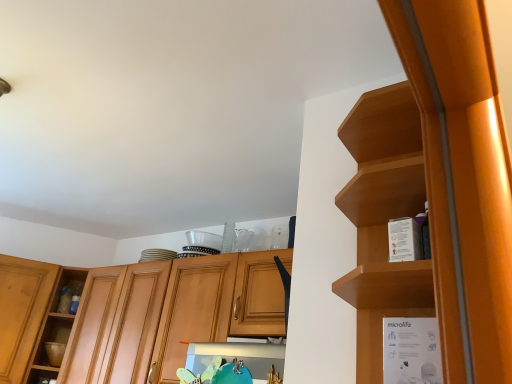
What do you see at coordinates (139, 312) in the screenshot? This screenshot has height=384, width=512. I see `wooden cabinet at center, acting as the 2th cabinetry starting from the right` at bounding box center [139, 312].

In order to face white cardboard box at right, should I rotate leftwards or rightwards?

Rotate your view right by about 22.180°.

How much space does wooden shelf at upper right, marked as the first cabinetry in a front-to-back arrangement, occupy vertically?

The height of wooden shelf at upper right, marked as the first cabinetry in a front-to-back arrangement, is 27.11 inches.

I want to click on wooden cabinet at center, which is the second cabinetry in front-to-back order, so [139, 312].

Considering the sizes of objects wooden shelf at upper right, which appears as the second cabinetry when viewed from the back, and white cardboard box at right in the image provided, who is taller, wooden shelf at upper right, which appears as the second cabinetry when viewed from the back, or white cardboard box at right?

wooden shelf at upper right, which appears as the second cabinetry when viewed from the back, is taller.

From a real-world perspective, is wooden shelf at upper right, which is the first cabinetry in right-to-left order, positioned under white cardboard box at right based on gravity?

Incorrect, from a real-world perspective, wooden shelf at upper right, which is the first cabinetry in right-to-left order, is higher than white cardboard box at right.

Can you confirm if wooden shelf at upper right, marked as the first cabinetry in a front-to-back arrangement, is smaller than white cardboard box at right?

No.

Is wooden shelf at upper right, which is the 2th cabinetry from left to right, at the right side of white cardboard box at right?

Incorrect, wooden shelf at upper right, which is the 2th cabinetry from left to right, is not on the right side of white cardboard box at right.

From the image's perspective, is wooden shelf at upper right, which is the first cabinetry in right-to-left order, located beneath wooden cabinet at center, which is the second cabinetry in front-to-back order?

No.

Is wooden shelf at upper right, which appears as the second cabinetry when viewed from the back, aimed at wooden cabinet at center, arranged as the first cabinetry when viewed from the left?

No, wooden shelf at upper right, which appears as the second cabinetry when viewed from the back, is not aimed at wooden cabinet at center, arranged as the first cabinetry when viewed from the left.

In the image, is wooden shelf at upper right, which is the 2th cabinetry from left to right, positioned in front of or behind wooden cabinet at center, which is the second cabinetry in front-to-back order?

Clearly, wooden shelf at upper right, which is the 2th cabinetry from left to right, is in front of wooden cabinet at center, which is the second cabinetry in front-to-back order.

Who is taller, white cardboard box at right or wooden cabinet at center, arranged as the first cabinetry when viewed from the left?

With more height is wooden cabinet at center, arranged as the first cabinetry when viewed from the left.

Is white cardboard box at right located outside wooden cabinet at center, arranged as the first cabinetry when viewed from the left?

Yes.

Is there a large distance between white cardboard box at right and wooden cabinet at center, arranged as the first cabinetry when viewed from the left?

Yes, white cardboard box at right is far from wooden cabinet at center, arranged as the first cabinetry when viewed from the left.

Could you tell me if white cardboard box at right is facing wooden cabinet at center, which is the second cabinetry in front-to-back order?

No.

Between point (362, 368) and point (453, 350), which one is positioned in front?

The point (453, 350) is in front.

Can you confirm if white cardboard box at right is bigger than wooden shelf at upper right, which appears as the second cabinetry when viewed from the back?

No.

From the image's perspective, between white cardboard box at right and wooden shelf at upper right, marked as the first cabinetry in a front-to-back arrangement, which one is located above?

wooden shelf at upper right, marked as the first cabinetry in a front-to-back arrangement, appears higher in the image.

Are white cardboard box at right and wooden shelf at upper right, which is the first cabinetry in right-to-left order, far apart?

They are positioned close to each other.

Is wooden cabinet at center, which is the first cabinetry from back to front, in front of white cardboard box at right?

No, it is behind white cardboard box at right.

Is wooden cabinet at center, arranged as the first cabinetry when viewed from the left, taller or shorter than white cardboard box at right?

wooden cabinet at center, arranged as the first cabinetry when viewed from the left, is taller than white cardboard box at right.

Is wooden cabinet at center, which is the first cabinetry from back to front, to the right of white cardboard box at right from the viewer's perspective?

In fact, wooden cabinet at center, which is the first cabinetry from back to front, is to the left of white cardboard box at right.

Is point (16, 338) positioned before point (413, 167)?

No, it is behind (413, 167).

From a real-world perspective, is wooden cabinet at center, which is the second cabinetry in front-to-back order, on wooden shelf at upper right, which is the first cabinetry in right-to-left order?

Incorrect, from a real-world perspective, wooden cabinet at center, which is the second cabinetry in front-to-back order, is lower than wooden shelf at upper right, which is the first cabinetry in right-to-left order.

Who is taller, wooden cabinet at center, which is the second cabinetry in front-to-back order, or wooden shelf at upper right, which is the 2th cabinetry from left to right?

wooden cabinet at center, which is the second cabinetry in front-to-back order, is taller.

I want to click on cabinet lying below the wooden shelf at upper right, which is the 2th cabinetry from left to right (from the image's perspective), so click(x=376, y=340).

Where is `cabinetry that is under the wooden shelf at upper right, marked as the first cabinetry in a front-to-back arrangement (from a real-world perspective)`? cabinetry that is under the wooden shelf at upper right, marked as the first cabinetry in a front-to-back arrangement (from a real-world perspective) is located at coordinates (139, 312).

Estimate the real-world distances between objects in this image. Which object is further from wooden shelf at upper right, which appears as the second cabinetry when viewed from the back, white cardboard box at right or wooden cabinet at center, which is the first cabinetry from back to front?

wooden cabinet at center, which is the first cabinetry from back to front, is further to wooden shelf at upper right, which appears as the second cabinetry when viewed from the back.

When comparing their distances from wooden cabinet at center, acting as the 2th cabinetry starting from the right, does wooden shelf at upper right, marked as the first cabinetry in a front-to-back arrangement, or white cardboard box at right seem closer?

Among the two, wooden shelf at upper right, marked as the first cabinetry in a front-to-back arrangement, is located nearer to wooden cabinet at center, acting as the 2th cabinetry starting from the right.

Considering their positions, is wooden cabinet at center, acting as the 2th cabinetry starting from the right, positioned closer to white cardboard box at right than wooden shelf at upper right, which is the 2th cabinetry from left to right?

wooden shelf at upper right, which is the 2th cabinetry from left to right, is positioned closer to the anchor white cardboard box at right.

When comparing their distances from white cardboard box at right, does wooden shelf at upper right, which appears as the second cabinetry when viewed from the back, or wooden cabinet at center, which is the first cabinetry from back to front, seem further?

Among the two, wooden cabinet at center, which is the first cabinetry from back to front, is located further to white cardboard box at right.

Estimate the real-world distances between objects in this image. Which object is further from wooden shelf at upper right, which appears as the second cabinetry when viewed from the back, wooden cabinet at center, acting as the 2th cabinetry starting from the right, or white cardboard box at right?

The object further to wooden shelf at upper right, which appears as the second cabinetry when viewed from the back, is wooden cabinet at center, acting as the 2th cabinetry starting from the right.

Which object lies further to the anchor point wooden cabinet at center, which is the first cabinetry from back to front, white cardboard box at right or wooden shelf at upper right, which is the 2th cabinetry from left to right?

The object further to wooden cabinet at center, which is the first cabinetry from back to front, is white cardboard box at right.

Find the location of a particular element. The height and width of the screenshot is (384, 512). cabinet between wooden shelf at upper right, which is the 2th cabinetry from left to right, and wooden cabinet at center, acting as the 2th cabinetry starting from the right, from front to back is located at coordinates (376, 340).